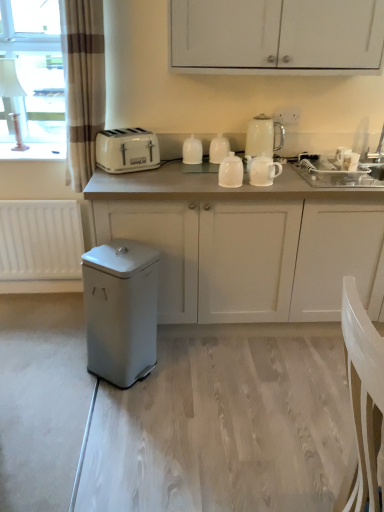
What are the coordinates of `vacant space in front of white matte trash can at lower left` in the screenshot? It's located at (114, 405).